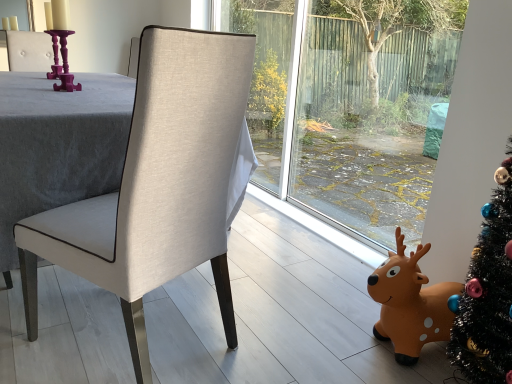
Question: From the image's perspective, relative to orange rubber reindeer at lower right, is matte beige fabric chair at center above or below?

Choices:
 (A) below
 (B) above

Answer: (B)

Question: In terms of size, does matte beige fabric chair at center appear bigger or smaller than orange rubber reindeer at lower right?

Choices:
 (A) big
 (B) small

Answer: (A)

Question: Based on their relative distances, which object is nearer to the matte beige fabric chair at center?

Choices:
 (A) purple glossy candle holder at upper left
 (B) orange rubber reindeer at lower right

Answer: (B)

Question: Considering the real-world distances, which object is closest to the matte beige fabric chair at center?

Choices:
 (A) orange rubber reindeer at lower right
 (B) purple glossy candle holder at upper left

Answer: (A)